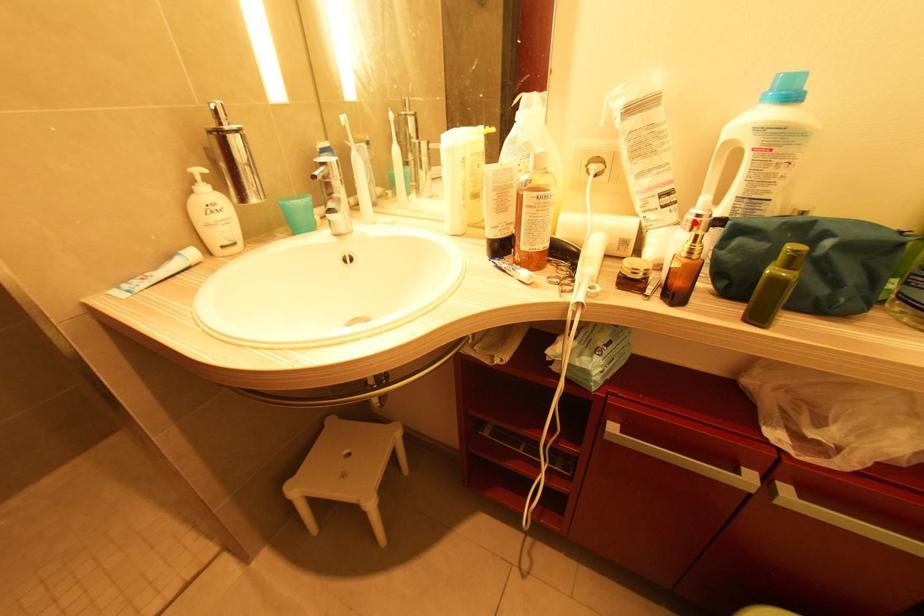
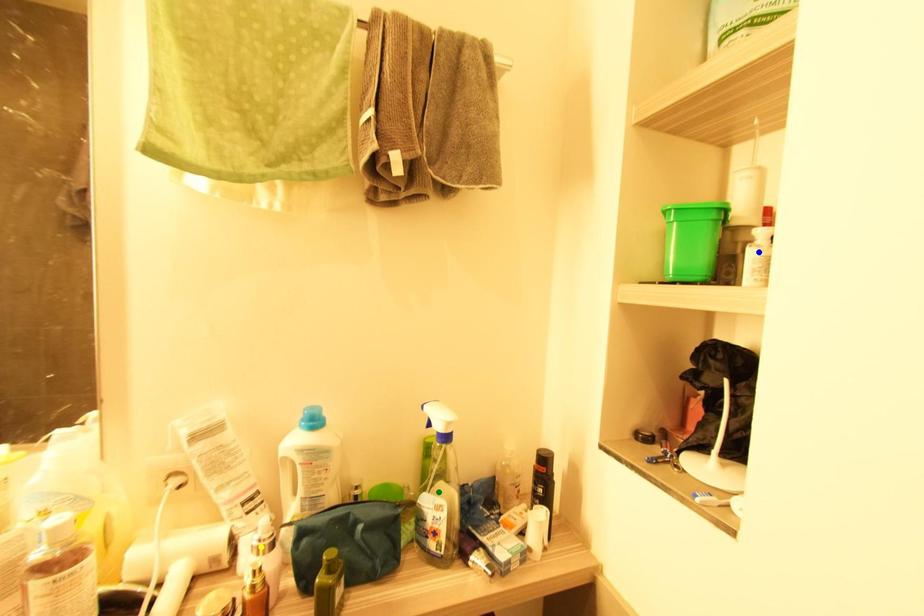
Question: I am providing you with two images of the same scene from different viewpoints. A red point is marked on the first image. You are given multiple points on the second image. Which point in image 2 is actually the same real-world point as the red point in image 1?

Choices:
 (A) green point
 (B) blue point
 (C) yellow point

Answer: (C)